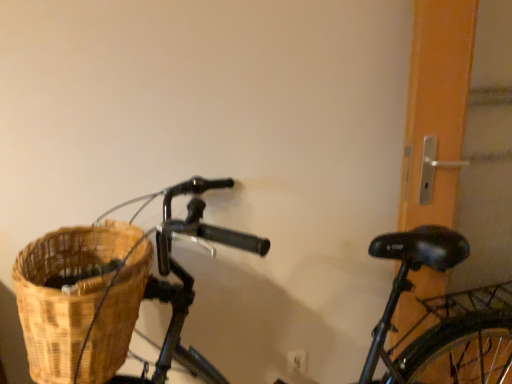
Describe the element at coordinates (411, 288) in the screenshot. The image size is (512, 384). I see `matte black bicycle at center` at that location.

Find the location of a particular element. This screenshot has width=512, height=384. matte black bicycle at center is located at coordinates point(411,288).

The image size is (512, 384). Find the location of `matte black bicycle at center`. matte black bicycle at center is located at coordinates (411, 288).